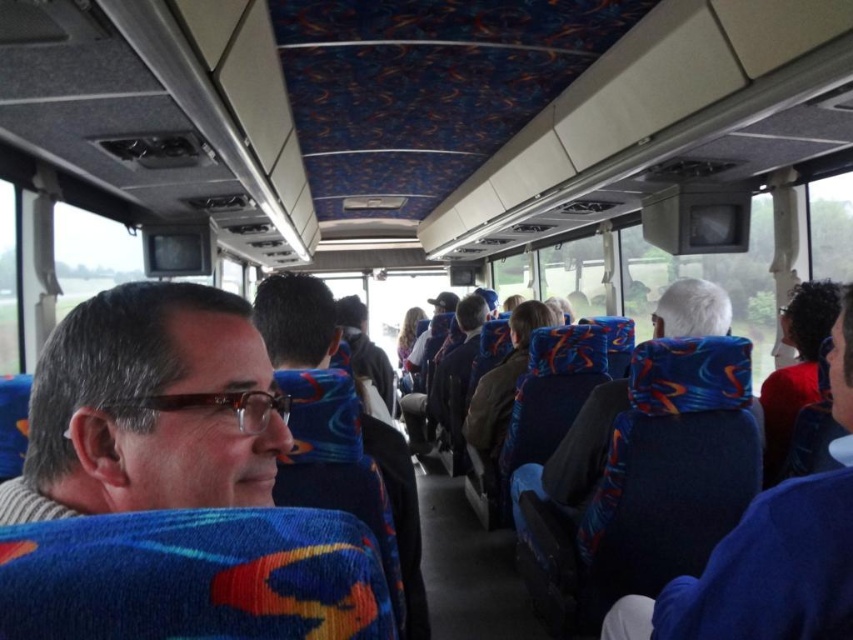
You are a passenger on this bus and need to decide whether to place your small backpack between the matte black glasses at left and the matte blue jacket at center. Based on their heights, will the backpack be visible from above when placed there?

The matte black glasses at left is not as tall as the matte blue jacket at center. Since the glasses are shorter, the backpack placed between them might still be partially visible from above, especially near the side of the shorter glasses.

You are a passenger on the bus and want to place your matte black glasses at left on the blue fabric headrest at right. Can you do so without the glasses falling off?

The matte black glasses at left is not as tall as blue fabric headrest at right, so the glasses will not fall off because they are shorter and can be placed securely on the headrest.